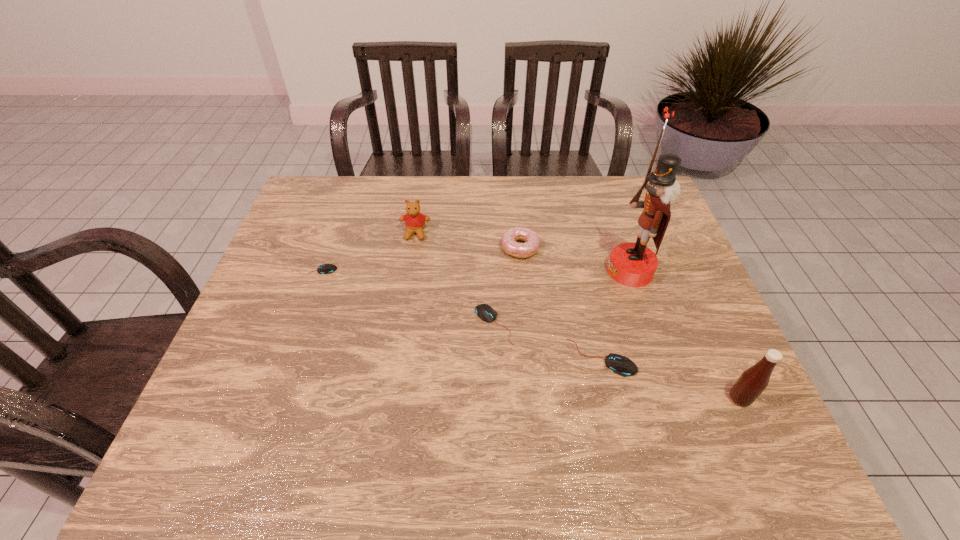
Please point a spot to place another mouse_(computer_equipment) for symmetrical spacing. Please provide its 2D coordinates. Your answer should be formatted as a tuple, i.e. [(x, y)], where the tuple contains the x and y coordinates of a point satisfying the conditions above.

[(399, 296)]